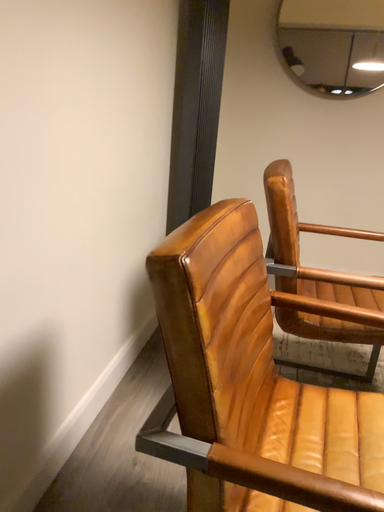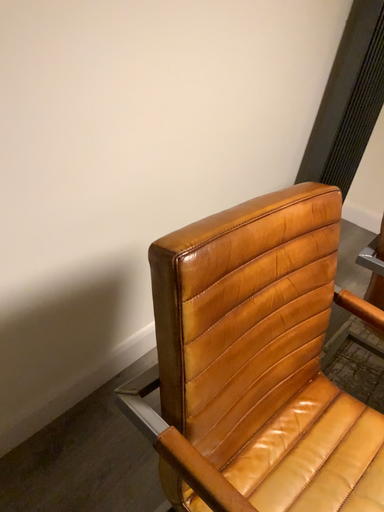
Question: Which way did the camera rotate in the video?

Choices:
 (A) rotated left
 (B) rotated right

Answer: (A)